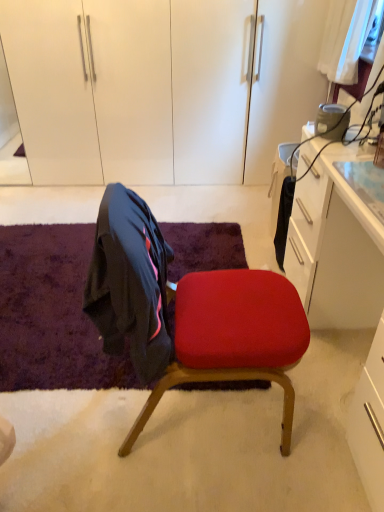
Question: In terms of size, does velvety purple mat at lower left appear bigger or smaller than velvet red chair at center?

Choices:
 (A) big
 (B) small

Answer: (B)

Question: Relative to velvet red chair at center, is velvety purple mat at lower left in front or behind?

Choices:
 (A) front
 (B) behind

Answer: (B)

Question: Considering the real-world distances, which object is farthest from the velvet red chair at center?

Choices:
 (A) velvety purple mat at lower left
 (B) white glossy dresser at upper center

Answer: (B)

Question: Considering the real-world distances, which object is closest to the velvet red chair at center?

Choices:
 (A) velvety purple mat at lower left
 (B) white glossy dresser at upper center

Answer: (A)